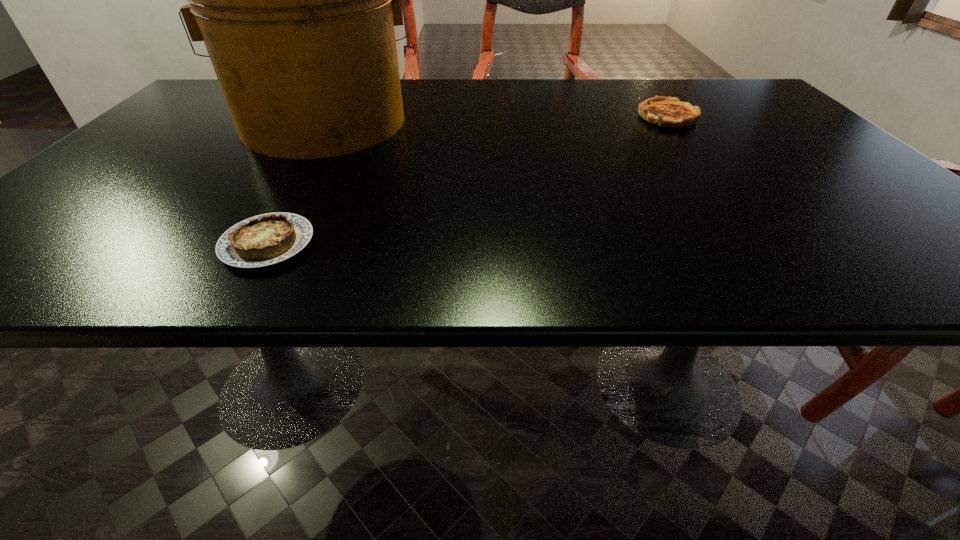
What are the coordinates of `the tallest object` in the screenshot? It's located at (296, 0).

The image size is (960, 540). In order to click on the rightmost object in this screenshot , I will do `click(662, 111)`.

In order to click on the taller quiche in this screenshot , I will do pos(662,111).

At what (x,y) coordinates should I click in order to perform the action: click on the shortest object. Please return your answer as a coordinate pair (x, y). This screenshot has height=540, width=960. Looking at the image, I should click on (267, 239).

Identify the location of the nearest object. (267, 239).

Identify the location of vacant area located on the front of the tallest object. (285, 180).

You are a GUI agent. You are given a task and a screenshot of the screen. Output one action in this format:
    pyautogui.click(x=<x>, y=<y>)
    Task: Click on the vacant space positioned on the back of the taller quiche
    
    Given the screenshot: What is the action you would take?
    pyautogui.click(x=646, y=90)

Locate an element on the screen. free spot located 0.140m on the right of the shortest object is located at coordinates (403, 244).

The image size is (960, 540). In order to click on bucket located at the far edge in this screenshot , I will do `click(296, 0)`.

You are a GUI agent. You are given a task and a screenshot of the screen. Output one action in this format:
    pyautogui.click(x=<x>, y=<y>)
    Task: Click on the quiche present at the far edge
    
    Given the screenshot: What is the action you would take?
    pyautogui.click(x=662, y=111)